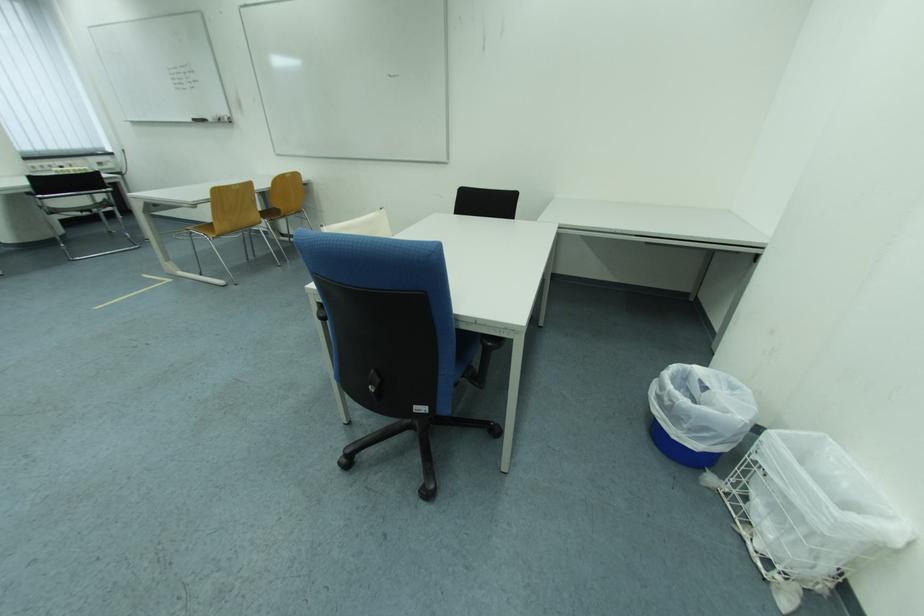
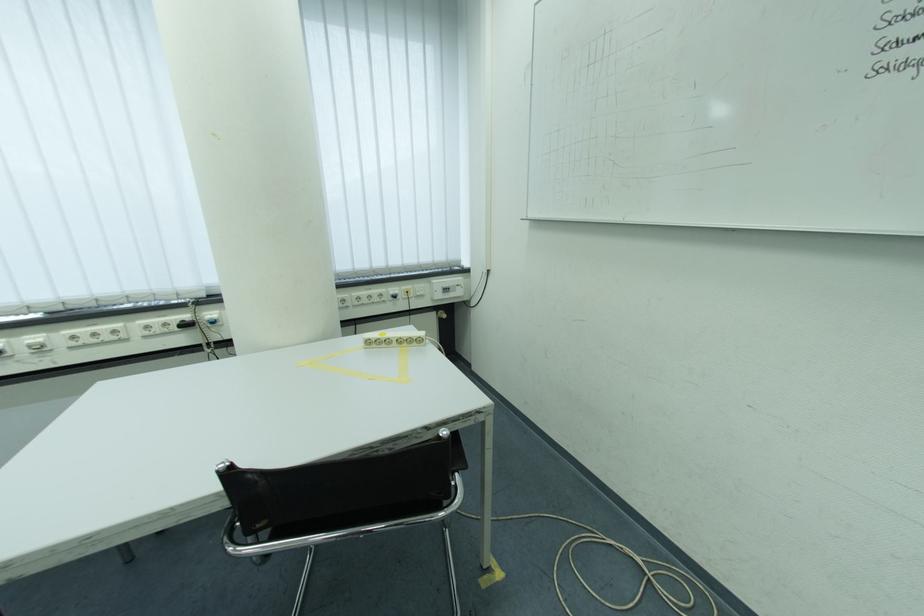
Find the pixel in the second image that matches point (43, 169) in the first image.

(368, 301)